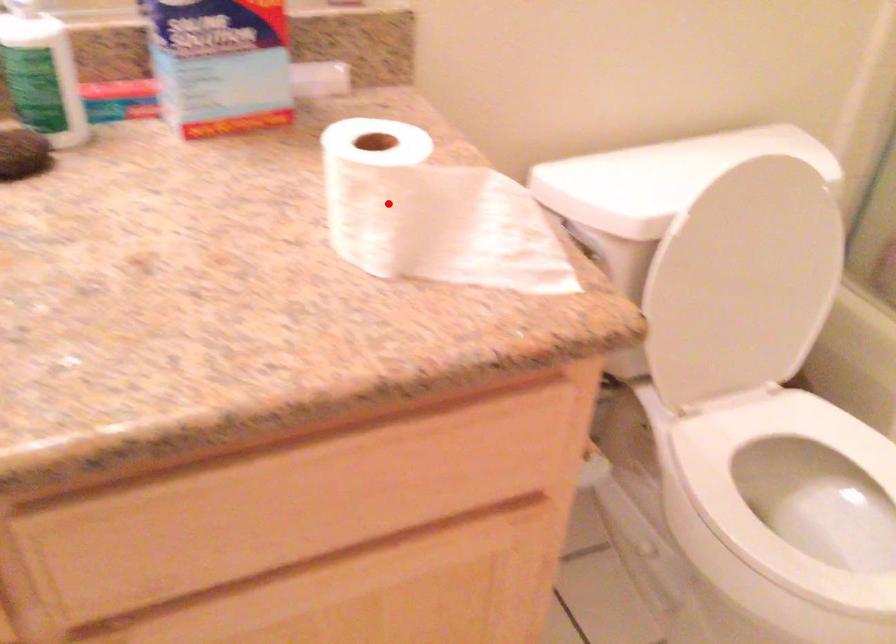
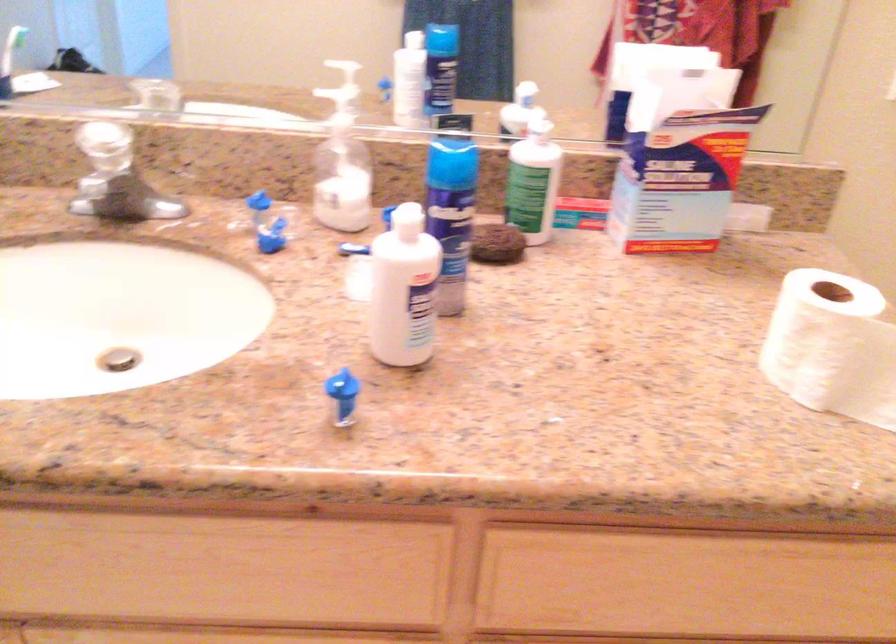
In the second image, find the point that corresponds to the highlighted location in the first image.

(831, 346)